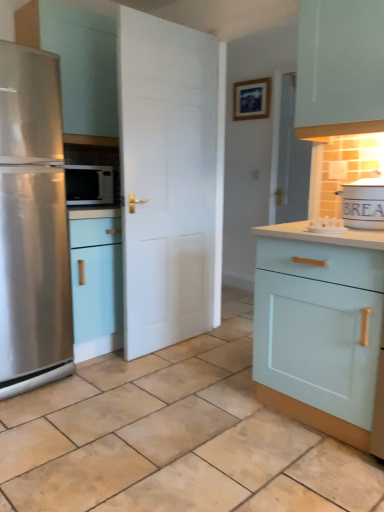
Question: Would you say stainless steel refrigerator at left is part of white matte tin canister at upper right's contents?

Choices:
 (A) yes
 (B) no

Answer: (B)

Question: Considering the relative sizes of white matte tin canister at upper right and stainless steel refrigerator at left in the image provided, is white matte tin canister at upper right taller than stainless steel refrigerator at left?

Choices:
 (A) no
 (B) yes

Answer: (A)

Question: Does white matte tin canister at upper right come behind stainless steel refrigerator at left?

Choices:
 (A) no
 (B) yes

Answer: (A)

Question: Considering the relative sizes of white matte tin canister at upper right and stainless steel refrigerator at left in the image provided, is white matte tin canister at upper right bigger than stainless steel refrigerator at left?

Choices:
 (A) yes
 (B) no

Answer: (B)

Question: From a real-world perspective, is white matte tin canister at upper right located higher than stainless steel refrigerator at left?

Choices:
 (A) no
 (B) yes

Answer: (B)

Question: Is stainless steel refrigerator at left at the back of white matte tin canister at upper right?

Choices:
 (A) yes
 (B) no

Answer: (B)

Question: Could white matte door at center be considered to be inside white matte tin canister at upper right?

Choices:
 (A) no
 (B) yes

Answer: (A)

Question: Can you confirm if white matte tin canister at upper right is thinner than white matte door at center?

Choices:
 (A) yes
 (B) no

Answer: (B)

Question: Is white matte tin canister at upper right looking in the opposite direction of white matte door at center?

Choices:
 (A) yes
 (B) no

Answer: (B)

Question: Is the depth of white matte tin canister at upper right greater than that of white matte door at center?

Choices:
 (A) no
 (B) yes

Answer: (A)

Question: From a real-world perspective, is white matte tin canister at upper right positioned under white matte door at center based on gravity?

Choices:
 (A) yes
 (B) no

Answer: (A)

Question: Does white matte tin canister at upper right have a smaller size compared to white matte door at center?

Choices:
 (A) yes
 (B) no

Answer: (A)

Question: Would you say light blue wood cabinet at right is a long distance from stainless steel refrigerator at left?

Choices:
 (A) no
 (B) yes

Answer: (B)